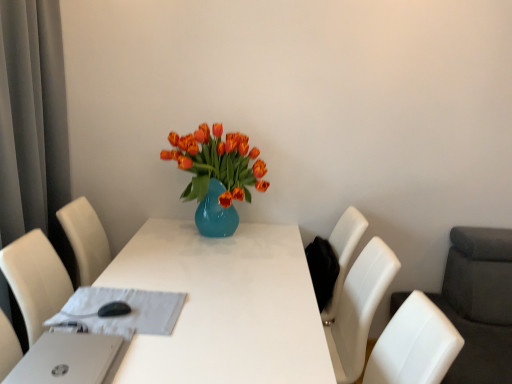
Question: Would you say white glossy table at center is outside white plastic laptop at lower left?

Choices:
 (A) yes
 (B) no

Answer: (A)

Question: Is white glossy table at center far from white plastic laptop at lower left?

Choices:
 (A) yes
 (B) no

Answer: (B)

Question: Is white glossy table at center closer to the viewer compared to white plastic laptop at lower left?

Choices:
 (A) yes
 (B) no

Answer: (B)

Question: From the image's perspective, is white glossy table at center below white plastic laptop at lower left?

Choices:
 (A) no
 (B) yes

Answer: (B)

Question: Considering the relative sizes of white glossy table at center and white plastic laptop at lower left in the image provided, is white glossy table at center bigger than white plastic laptop at lower left?

Choices:
 (A) no
 (B) yes

Answer: (B)

Question: Can you confirm if white glossy table at center is taller than white plastic laptop at lower left?

Choices:
 (A) yes
 (B) no

Answer: (A)

Question: Can you confirm if white glossy table at center is shorter than matte blue vase at center?

Choices:
 (A) yes
 (B) no

Answer: (B)

Question: Can you see white glossy table at center touching matte blue vase at center?

Choices:
 (A) no
 (B) yes

Answer: (A)

Question: From the image's perspective, does white glossy table at center appear higher than matte blue vase at center?

Choices:
 (A) no
 (B) yes

Answer: (A)

Question: Considering the relative sizes of white glossy table at center and matte blue vase at center in the image provided, is white glossy table at center wider than matte blue vase at center?

Choices:
 (A) yes
 (B) no

Answer: (A)

Question: Considering the relative positions of white glossy table at center and matte blue vase at center in the image provided, is white glossy table at center behind matte blue vase at center?

Choices:
 (A) yes
 (B) no

Answer: (B)

Question: Is white glossy table at center facing towards matte blue vase at center?

Choices:
 (A) yes
 (B) no

Answer: (B)

Question: Does white glossy table at center appear on the right side of white fabric at center?

Choices:
 (A) no
 (B) yes

Answer: (B)